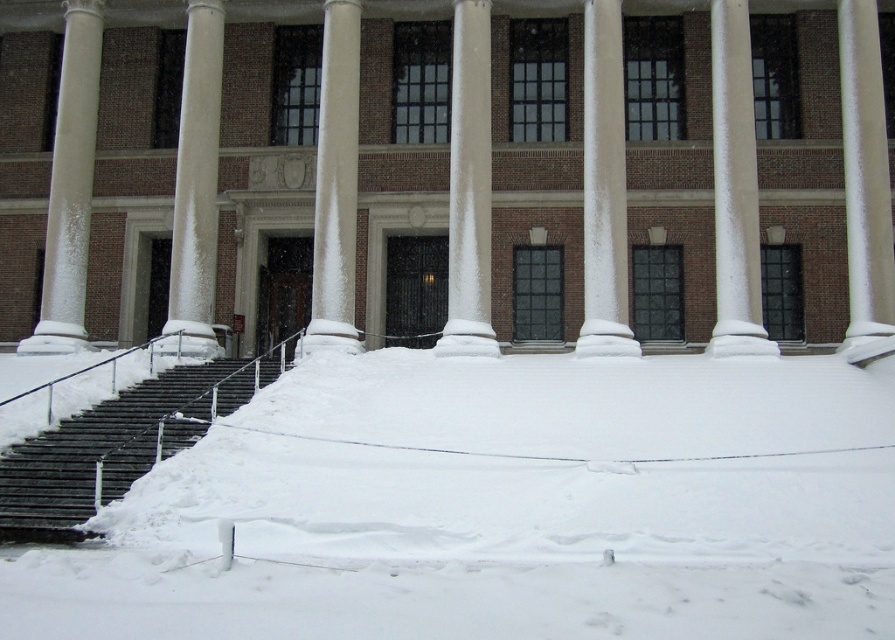
Question: Estimate the real-world distances between objects in this image. Which object is closer to the white fluffy snow at lower center?

Choices:
 (A) white textured column at left
 (B) white snow-covered column at center

Answer: (B)

Question: Does white textured column at left lie in front of white snow-covered column at center?

Choices:
 (A) yes
 (B) no

Answer: (B)

Question: Estimate the real-world distances between objects in this image. Which object is closer to the white fluffy snow at lower center?

Choices:
 (A) white textured column at left
 (B) white frosty column at left
 (C) white frosted pillar at right
 (D) white frosty column at center

Answer: (D)

Question: Which object is the farthest from the white fluffy snow at lower center?

Choices:
 (A) white frosty column at left
 (B) white snow-covered column at center
 (C) white textured column at left
 (D) white frosty column at center

Answer: (C)

Question: Can you confirm if white fluffy snow at lower center is smaller than white frosty column at center?

Choices:
 (A) yes
 (B) no

Answer: (B)

Question: Is white frosted pillar at right thinner than white frosty column at left?

Choices:
 (A) yes
 (B) no

Answer: (B)